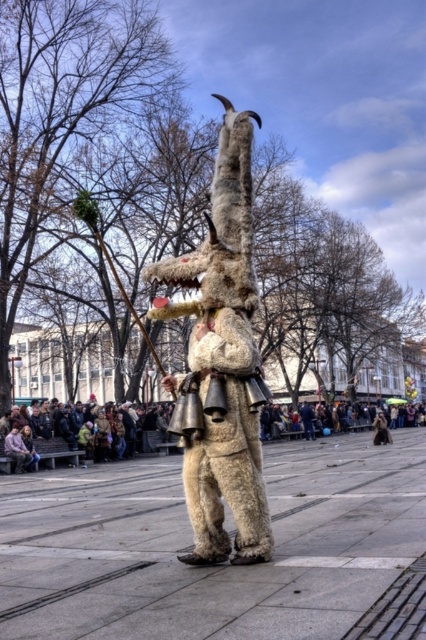
Does smooth concrete pavement at center have a larger size compared to dark brown leather jacket at lower center?

No.

Is smooth concrete pavement at center in front of dark brown leather jacket at lower center?

Yes, smooth concrete pavement at center is in front of dark brown leather jacket at lower center.

Where is `smooth concrete pavement at center`? smooth concrete pavement at center is located at coordinates (190, 541).

Is furry beige costume at center bigger than dark brown leather jacket at lower center?

Actually, furry beige costume at center might be smaller than dark brown leather jacket at lower center.

I want to click on furry beige costume at center, so click(x=227, y=449).

Which is more to the left, furry beige creature at center or dark brown leather jacket at lower center?

From the viewer's perspective, furry beige creature at center appears more on the left side.

Who is positioned more to the right, furry beige creature at center or dark brown leather jacket at lower center?

From the viewer's perspective, dark brown leather jacket at lower center appears more on the right side.

Measure the distance between furry beige creature at center and camera.

furry beige creature at center is 20.50 meters from camera.

The height and width of the screenshot is (640, 426). Find the location of `furry beige creature at center`. furry beige creature at center is located at coordinates click(x=221, y=364).